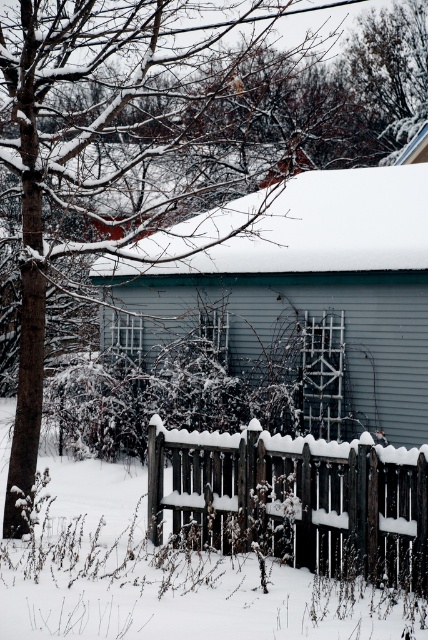
Does smooth gray siding at center have a larger size compared to snow-covered wooden fence at center?

No, smooth gray siding at center is not bigger than snow-covered wooden fence at center.

Measure the distance from smooth gray siding at center to snow-covered wooden fence at center.

The distance of smooth gray siding at center from snow-covered wooden fence at center is 7.68 meters.

Is point (231, 273) farther from viewer compared to point (383, 516)?

Yes.

Locate an element on the screen. Image resolution: width=428 pixels, height=640 pixels. smooth gray siding at center is located at coordinates (306, 298).